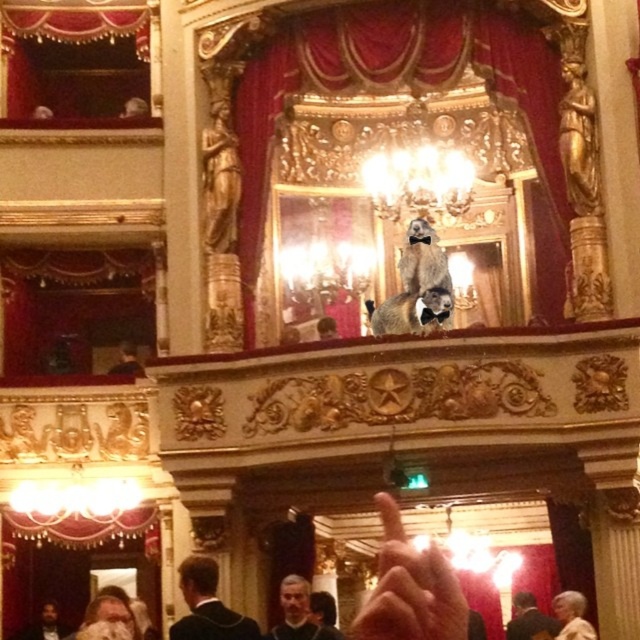
Describe the element at coordinates (300, 612) in the screenshot. I see `gray hair at center` at that location.

Is point (280, 589) closer to camera compared to point (36, 630)?

Yes, point (280, 589) is closer to viewer.

What are the coordinates of `gray hair at center` in the screenshot? It's located at (300, 612).

Does dark suit at center come behind dark brown suit at lower left?

No, dark suit at center is in front of dark brown suit at lower left.

At what (x,y) coordinates should I click in order to perform the action: click on dark suit at center. Please return your answer as a coordinate pair (x, y). The image size is (640, 640). Looking at the image, I should click on (208, 605).

From the picture: Who is positioned more to the right, flesh-toned skin at center or smooth gray suit at lower right?

smooth gray suit at lower right is more to the right.

Consider the image. Is flesh-toned skin at center wider than smooth gray suit at lower right?

Indeed, flesh-toned skin at center has a greater width compared to smooth gray suit at lower right.

Between point (397, 541) and point (525, 616), which one is positioned behind?

Point (525, 616)

Identify the location of flesh-toned skin at center. (410, 588).